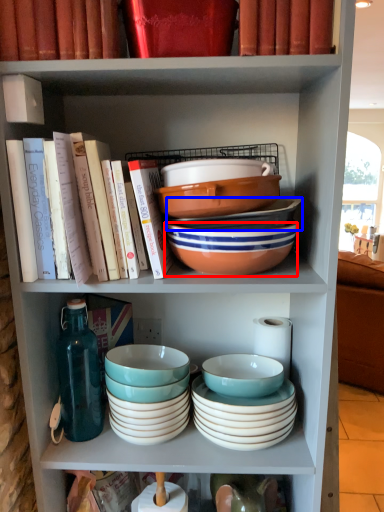
Question: Which object appears closest to the camera in this image, bowl (highlighted by a red box) or bowl (highlighted by a blue box)?

Choices:
 (A) bowl
 (B) bowl

Answer: (A)